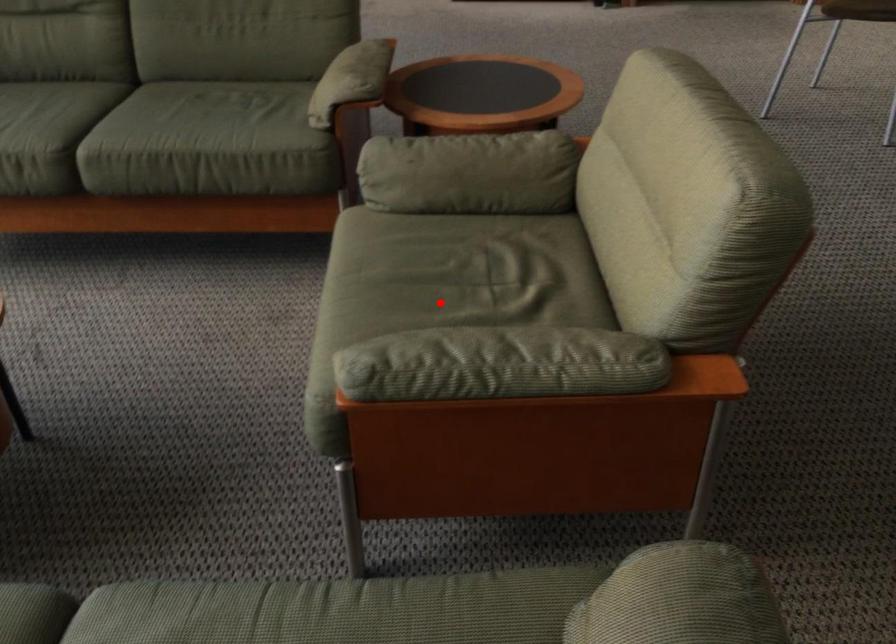
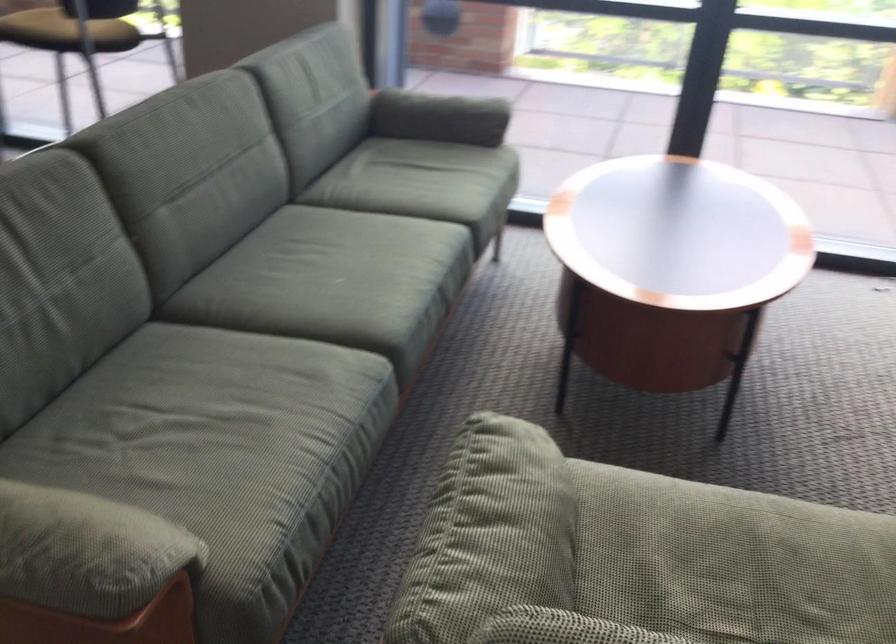
Question: I am providing you with two images of the same scene from different viewpoints. Given a red point in image1, look at the same physical point in image2. Is it:

Choices:
 (A) Closer to the viewpoint
 (B) Farther from the viewpoint

Answer: (A)